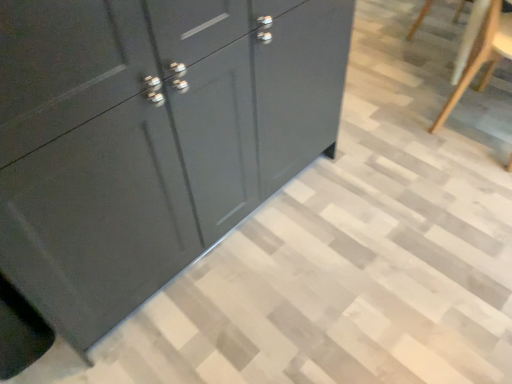
What do you see at coordinates (482, 55) in the screenshot? Image resolution: width=512 pixels, height=384 pixels. I see `light wood chair at right` at bounding box center [482, 55].

Image resolution: width=512 pixels, height=384 pixels. I want to click on light wood chair at right, so click(482, 55).

What are the coordinates of `light wood chair at right` in the screenshot? It's located at (482, 55).